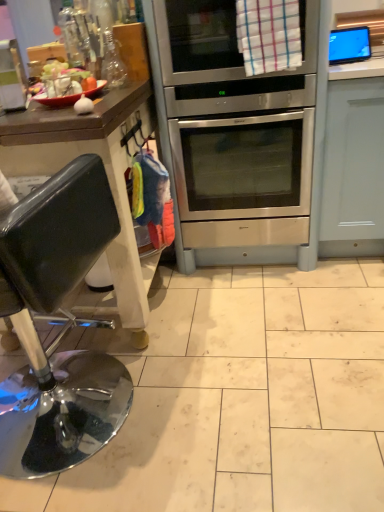
Question: Is shiny black stool at left further to camera compared to flat screen tv at upper right?

Choices:
 (A) no
 (B) yes

Answer: (A)

Question: Does shiny black stool at left have a lesser width compared to flat screen tv at upper right?

Choices:
 (A) no
 (B) yes

Answer: (A)

Question: Does shiny black stool at left have a larger size compared to flat screen tv at upper right?

Choices:
 (A) no
 (B) yes

Answer: (B)

Question: Is shiny black stool at left facing away from flat screen tv at upper right?

Choices:
 (A) yes
 (B) no

Answer: (B)

Question: Is shiny black stool at left outside flat screen tv at upper right?

Choices:
 (A) no
 (B) yes

Answer: (B)

Question: Are shiny black stool at left and flat screen tv at upper right located far from each other?

Choices:
 (A) no
 (B) yes

Answer: (B)

Question: Can you confirm if stainless steel oven at center is smaller than flat screen tv at upper right?

Choices:
 (A) no
 (B) yes

Answer: (A)

Question: Considering the relative positions of stainless steel oven at center and flat screen tv at upper right in the image provided, is stainless steel oven at center to the right of flat screen tv at upper right from the viewer's perspective?

Choices:
 (A) yes
 (B) no

Answer: (B)

Question: Does stainless steel oven at center have a lesser height compared to flat screen tv at upper right?

Choices:
 (A) yes
 (B) no

Answer: (B)

Question: Is stainless steel oven at center positioned beyond the bounds of flat screen tv at upper right?

Choices:
 (A) no
 (B) yes

Answer: (B)

Question: Is stainless steel oven at center taller than flat screen tv at upper right?

Choices:
 (A) yes
 (B) no

Answer: (A)

Question: Does stainless steel oven at center come behind flat screen tv at upper right?

Choices:
 (A) yes
 (B) no

Answer: (B)

Question: Are stainless steel oven at center and shiny black stool at left making contact?

Choices:
 (A) yes
 (B) no

Answer: (B)